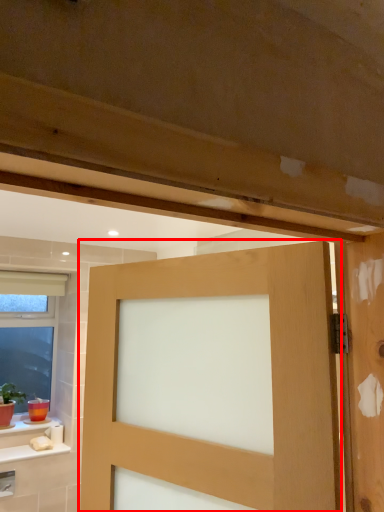
Question: In this image, where is door (annotated by the red box) located relative to window?

Choices:
 (A) left
 (B) right

Answer: (B)